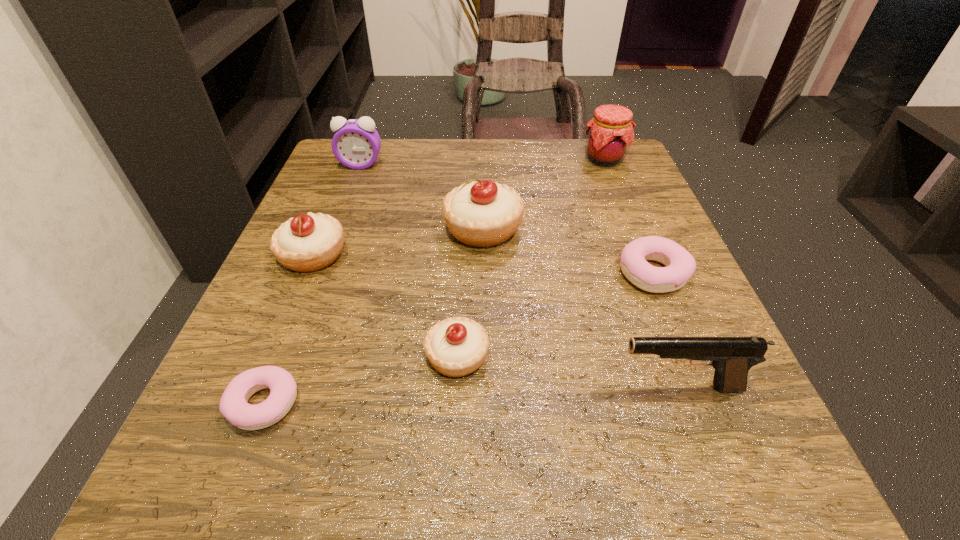
This screenshot has height=540, width=960. Identify the location of vacant space at the far edge. (447, 146).

Where is `free space at the near edge of the desktop`? free space at the near edge of the desktop is located at coordinates (487, 451).

The image size is (960, 540). Find the location of `vacant space at the left edge of the desktop`. vacant space at the left edge of the desktop is located at coordinates (345, 347).

Identify the location of free spot at the right edge of the desktop. (633, 394).

Locate an element on the screen. vacant space at the far left corner of the desktop is located at coordinates (396, 152).

In order to click on vacant space at the near left corner of the desktop in this screenshot , I will do `click(256, 437)`.

The width and height of the screenshot is (960, 540). I want to click on vacant space at the far right corner of the desktop, so click(x=632, y=174).

This screenshot has height=540, width=960. I want to click on vacant space at the near right corner of the desktop, so click(x=703, y=471).

This screenshot has width=960, height=540. I want to click on unoccupied position between the second smallest beige pastry and the tallest pastry, so click(398, 241).

Find the location of a particular element. empty space between the pistol and the alarm clock is located at coordinates (519, 276).